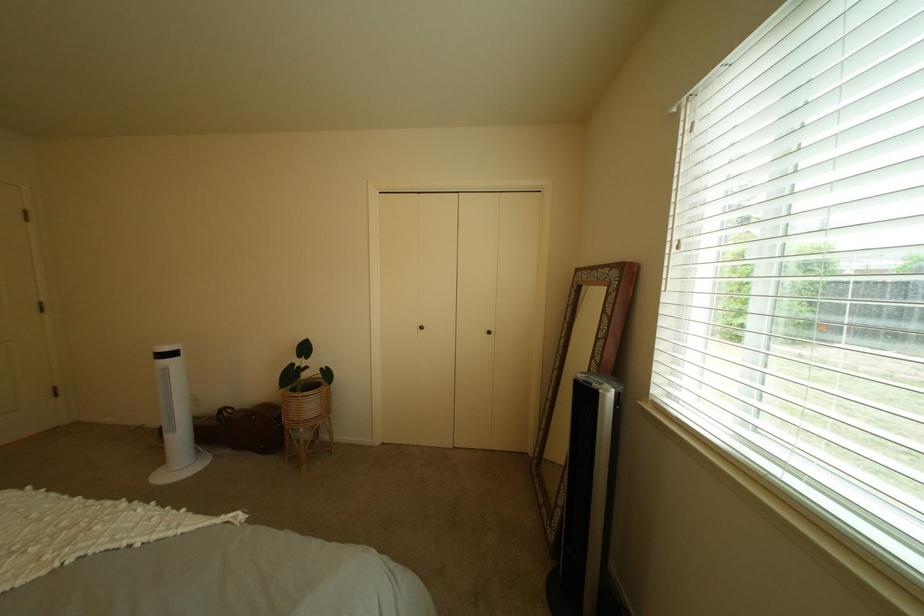
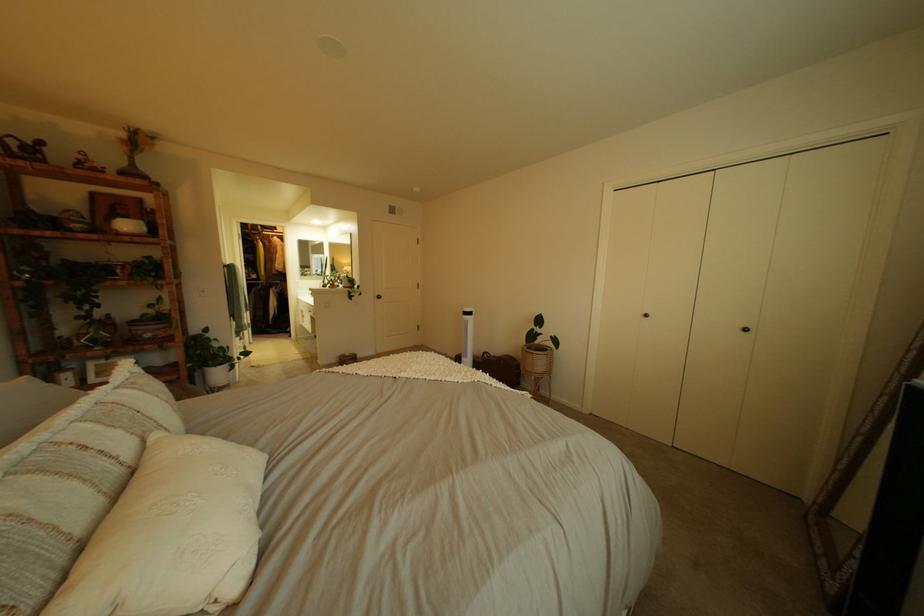
Find the pixel in the second image that matches point (43, 517) in the first image.

(468, 365)